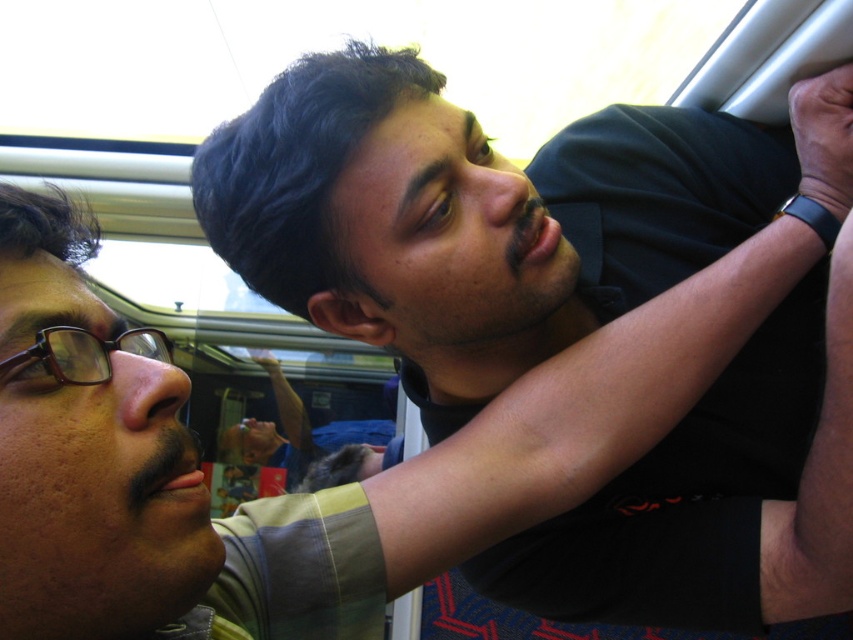
You are a passenger on a train and you want to know if the black matte shirt at upper center is covering the brown plastic glasses at left. Can you confirm?

The black matte shirt at upper center is positioned over brown plastic glasses at left, so yes, it is covering the brown plastic glasses at left.

You are a passenger on a train and need to determine which object is bigger between the black matte shirt at upper center and the brown plastic glasses at left. Based on the scene description, which one is larger?

The black matte shirt at upper center has a larger size compared to the brown plastic glasses at left, so the black matte shirt at upper center is bigger.

You are a passenger on a train and want to place a small backpack on the floor near the point marked as point (270, 113). Considering the space available, can you estimate if there is enough room for the backpack without it being in the way of the seats or other passengers?

The point marked as point (270, 113) is 23.64 inches away from the viewer, so there should be sufficient space to place the backpack there without obstructing seats or other passengers.